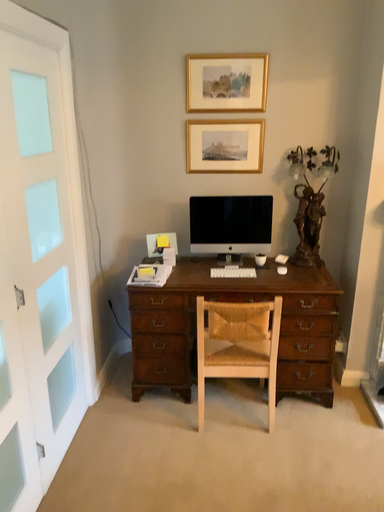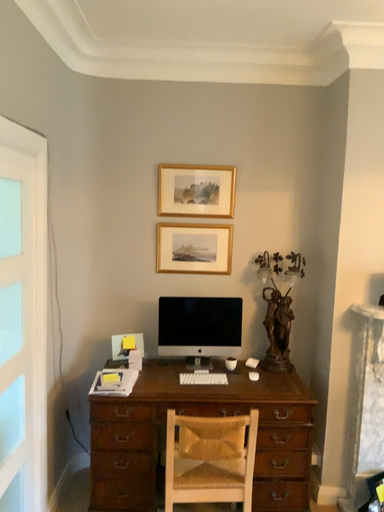
Question: Which way did the camera rotate in the video?

Choices:
 (A) rotated upward
 (B) rotated downward

Answer: (A)